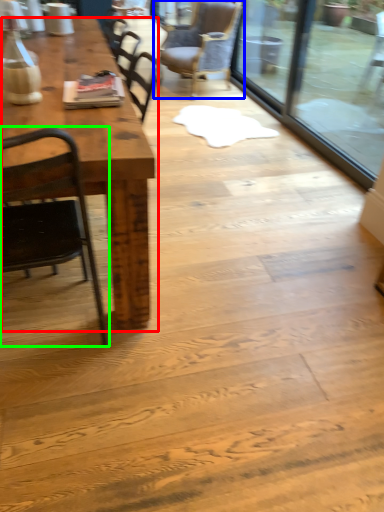
Question: Which object is positioned closest to table (highlighted by a red box)? Select from chair (highlighted by a blue box) and chair (highlighted by a green box).

Choices:
 (A) chair
 (B) chair

Answer: (B)